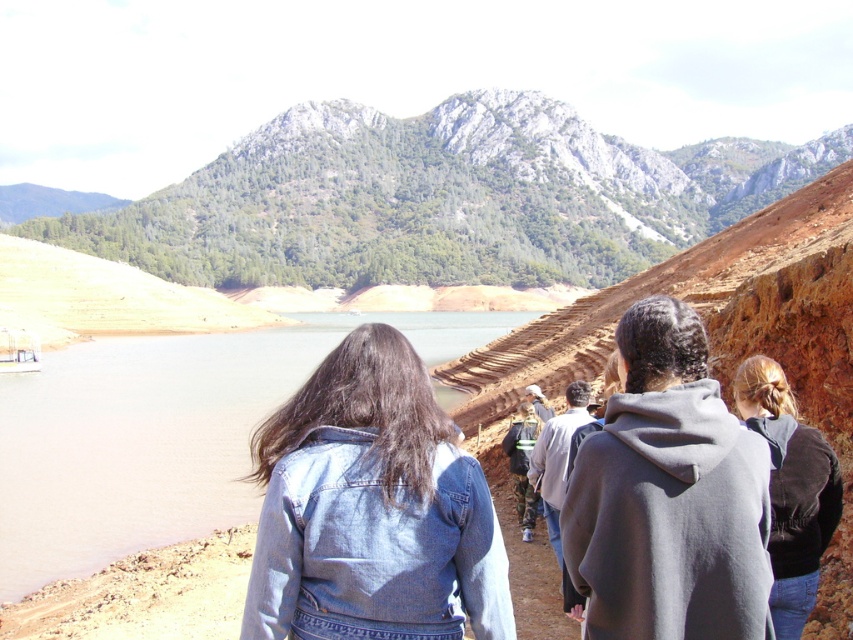
Question: Which point is closer to the camera?

Choices:
 (A) rugged stone mountain at upper center
 (B) gray fleece jacket at center
 (C) denim jacket at lower center

Answer: (B)

Question: Estimate the real-world distances between objects in this image. Which object is farther from the brown matte water at lower left?

Choices:
 (A) gray fleece jacket at center
 (B) black velvet jacket at right
 (C) rugged stone mountain at upper center

Answer: (C)

Question: Does rugged stone mountain at upper center appear under brown matte water at lower left?

Choices:
 (A) yes
 (B) no

Answer: (B)

Question: Is rugged stone mountain at upper center closer to the viewer compared to denim jacket at lower center?

Choices:
 (A) yes
 (B) no

Answer: (B)

Question: Which point is closer to the camera taking this photo?

Choices:
 (A) (759, 387)
 (B) (256, 362)
 (C) (762, 630)
 (D) (416, 589)

Answer: (C)

Question: Is rugged stone mountain at upper center positioned in front of denim jacket at lower center?

Choices:
 (A) no
 (B) yes

Answer: (A)